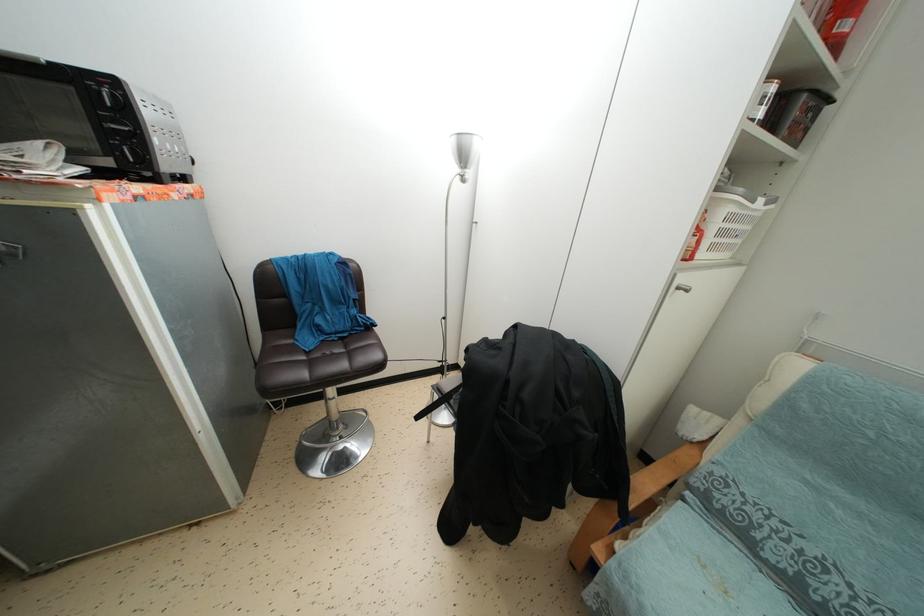
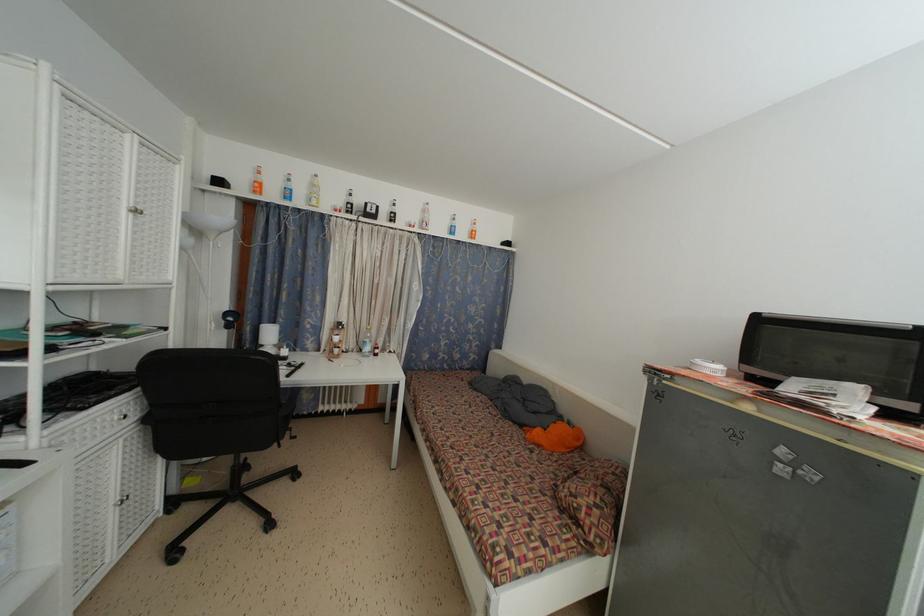
Question: The camera is either moving clockwise (left) or counter-clockwise (right) around the object. The first image is from the beginning of the video and the second image is from the end. Is the camera moving left or right when shooting the video?

Choices:
 (A) Left
 (B) Right

Answer: (B)